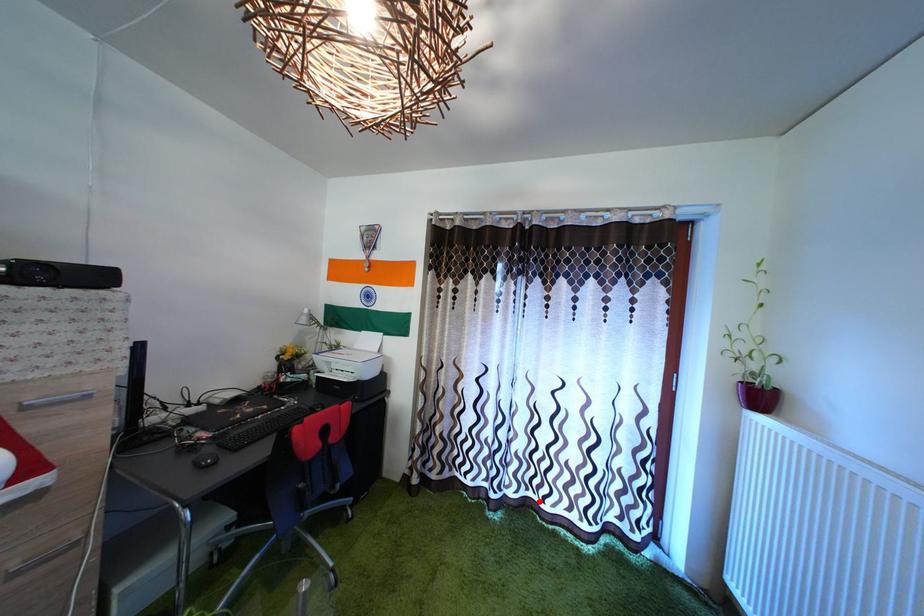
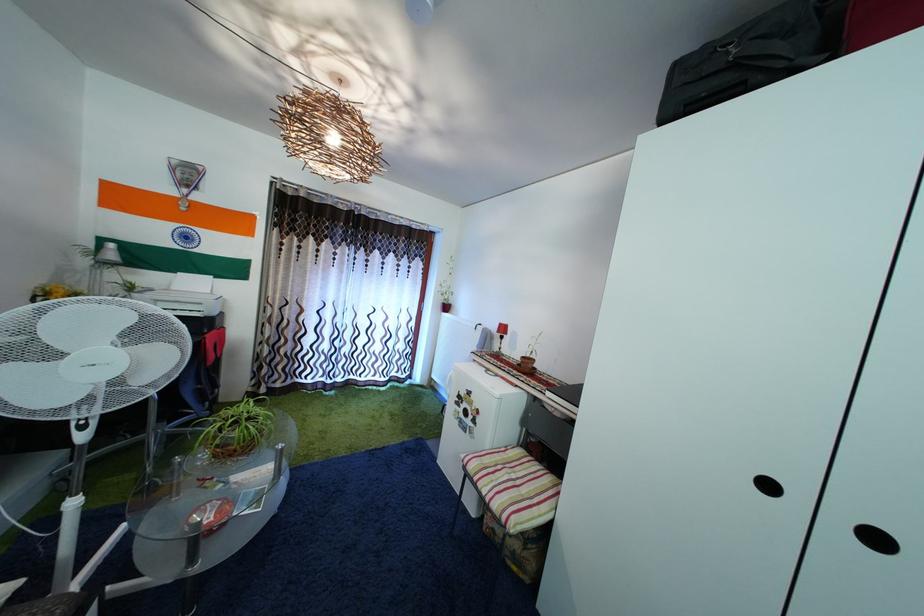
Where in the second image is the point corresponding to the highlighted location from the first image?

(359, 384)